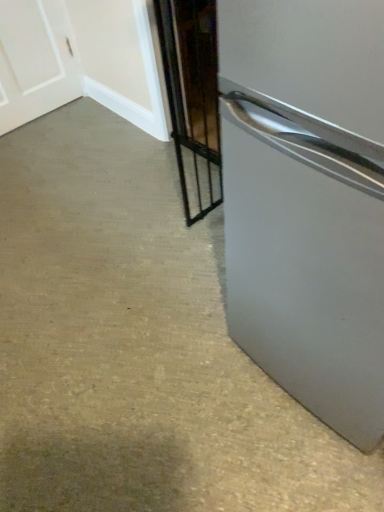
At what (x,y) coordinates should I click in order to perform the action: click on free region under black metal screen door at center (from a real-world perspective). Please return your answer as a coordinate pair (x, y). The width and height of the screenshot is (384, 512). Looking at the image, I should click on (207, 230).